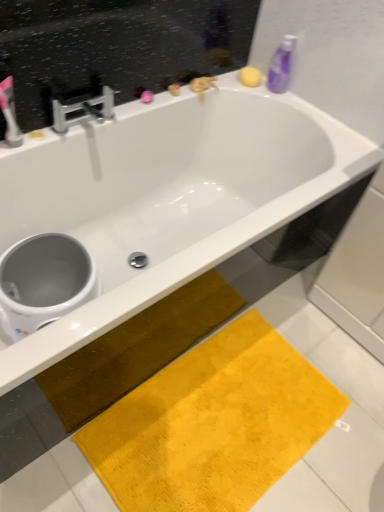
Question: Is matte white toothbrush at upper left at the left side of white glossy bathtub at upper center?

Choices:
 (A) no
 (B) yes

Answer: (B)

Question: From a real-world perspective, is matte white toothbrush at upper left under white glossy bathtub at upper center?

Choices:
 (A) no
 (B) yes

Answer: (A)

Question: Is matte white toothbrush at upper left oriented away from white glossy bathtub at upper center?

Choices:
 (A) yes
 (B) no

Answer: (B)

Question: Considering the relative sizes of matte white toothbrush at upper left and white glossy bathtub at upper center in the image provided, is matte white toothbrush at upper left wider than white glossy bathtub at upper center?

Choices:
 (A) yes
 (B) no

Answer: (B)

Question: From the image's perspective, would you say matte white toothbrush at upper left is shown under white glossy bathtub at upper center?

Choices:
 (A) no
 (B) yes

Answer: (A)

Question: Would you say matte white toothbrush at upper left is a long distance from white glossy bathtub at upper center?

Choices:
 (A) yes
 (B) no

Answer: (B)

Question: Is matte white toothbrush at upper left not near chrome metallic faucet at upper left?

Choices:
 (A) no
 (B) yes

Answer: (A)

Question: Is matte white toothbrush at upper left placed right next to chrome metallic faucet at upper left?

Choices:
 (A) yes
 (B) no

Answer: (B)

Question: From the image's perspective, is matte white toothbrush at upper left located beneath chrome metallic faucet at upper left?

Choices:
 (A) no
 (B) yes

Answer: (B)

Question: From the image's perspective, is matte white toothbrush at upper left on chrome metallic faucet at upper left?

Choices:
 (A) no
 (B) yes

Answer: (A)

Question: Does matte white toothbrush at upper left have a lesser height compared to chrome metallic faucet at upper left?

Choices:
 (A) no
 (B) yes

Answer: (A)

Question: Is matte white toothbrush at upper left taller than chrome metallic faucet at upper left?

Choices:
 (A) yes
 (B) no

Answer: (A)

Question: Does white glossy toilet bowl at lower left have a lesser height compared to purple plastic bottle at upper right?

Choices:
 (A) no
 (B) yes

Answer: (A)